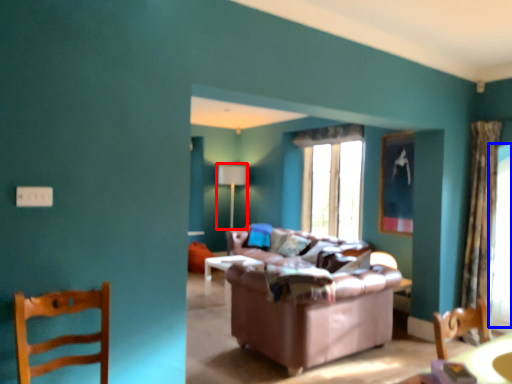
Question: Which point is further to the camera, lamp (highlighted by a red box) or window screen (highlighted by a blue box)?

Choices:
 (A) lamp
 (B) window screen

Answer: (A)